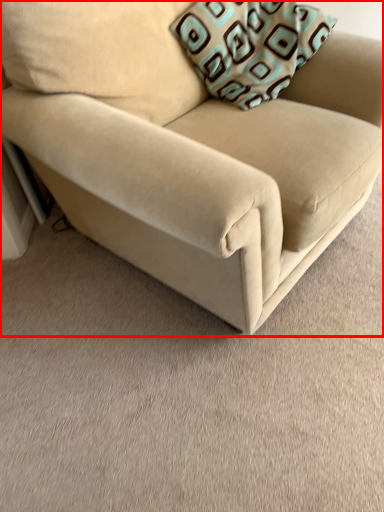
Question: From the image's perspective, where is studio couch (annotated by the red box) located in relation to throw pillow in the image?

Choices:
 (A) below
 (B) above

Answer: (A)